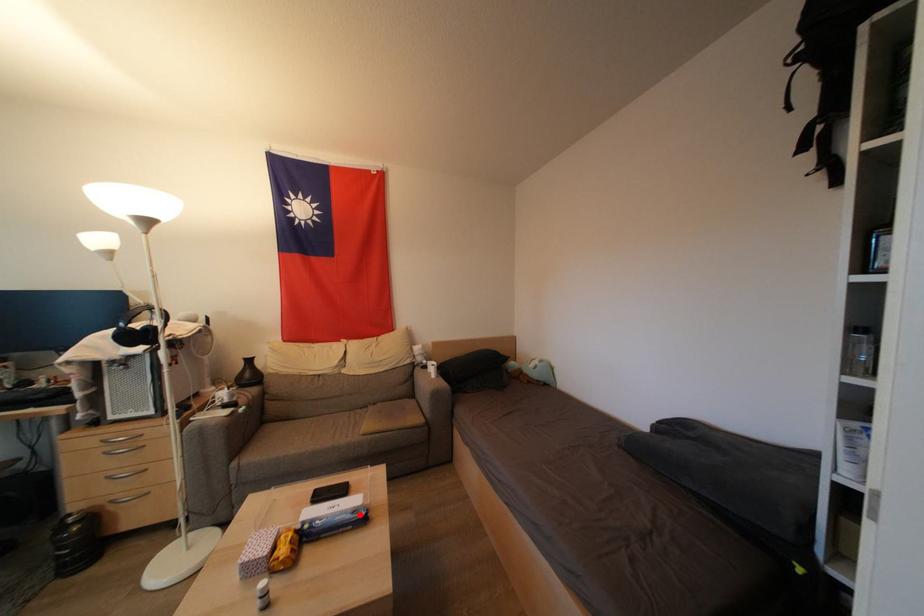
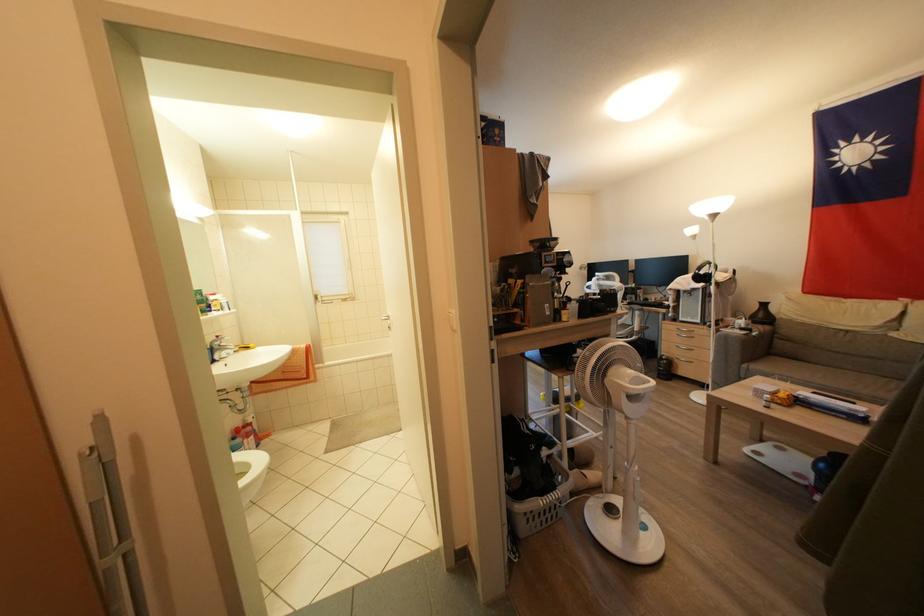
Find the pixel in the second image that matches the highlighted location in the first image.

(858, 415)